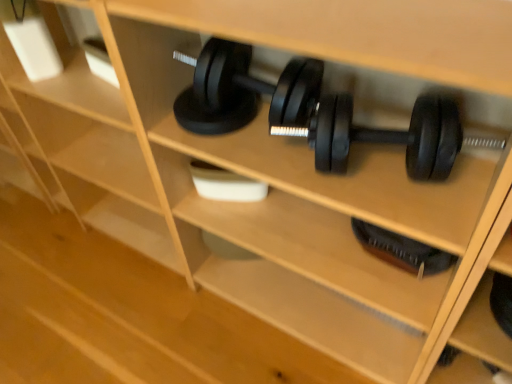
This screenshot has height=384, width=512. Find the location of `black rubber dumbbell at center, the first dumbbell when ordered from front to back`. black rubber dumbbell at center, the first dumbbell when ordered from front to back is located at coordinates (386, 135).

This screenshot has height=384, width=512. What do you see at coordinates (386, 135) in the screenshot? I see `black rubber dumbbell at center, placed as the second dumbbell when sorted from bottom to top` at bounding box center [386, 135].

What do you see at coordinates (401, 250) in the screenshot? I see `black rubber dumbbell at lower center, which ranks as the 2th dumbbell in front-to-back order` at bounding box center [401, 250].

Where is `black rubber dumbbell at lower center, which ranks as the 2th dumbbell in front-to-back order`? black rubber dumbbell at lower center, which ranks as the 2th dumbbell in front-to-back order is located at coordinates (401, 250).

Measure the distance between point [418,269] and camera.

Point [418,269] and camera are 1.02 meters apart from each other.

What is the approximate width of black rubber dumbbell at lower center, placed as the first dumbbell when sorted from bottom to top?

black rubber dumbbell at lower center, placed as the first dumbbell when sorted from bottom to top, is 5.11 inches in width.

The image size is (512, 384). What are the coordinates of `black rubber dumbbell at center, which is the first dumbbell in top-to-bottom order` in the screenshot? It's located at (386, 135).

Considering the relative positions of black rubber dumbbell at center, which is the first dumbbell in top-to-bottom order, and black rubber dumbbell at lower center, the 1th dumbbell in the back-to-front sequence, in the image provided, is black rubber dumbbell at center, which is the first dumbbell in top-to-bottom order, to the left or to the right of black rubber dumbbell at lower center, the 1th dumbbell in the back-to-front sequence,?

Clearly, black rubber dumbbell at center, which is the first dumbbell in top-to-bottom order, is on the left of black rubber dumbbell at lower center, the 1th dumbbell in the back-to-front sequence, in the image.

Is black rubber dumbbell at center, placed as the second dumbbell when sorted from bottom to top, positioned in front of black rubber dumbbell at lower center, the 1th dumbbell in the back-to-front sequence?

Yes, the depth of black rubber dumbbell at center, placed as the second dumbbell when sorted from bottom to top, is less than that of black rubber dumbbell at lower center, the 1th dumbbell in the back-to-front sequence.

Considering the points (424, 132) and (355, 225), which point is in front, point (424, 132) or point (355, 225)?

Point (424, 132)

From the image's perspective, would you say black rubber dumbbell at center, which appears as the second dumbbell when viewed from the back, is shown under black rubber dumbbell at lower center, the 1th dumbbell in the back-to-front sequence?

No, from the image's perspective, black rubber dumbbell at center, which appears as the second dumbbell when viewed from the back, is not beneath black rubber dumbbell at lower center, the 1th dumbbell in the back-to-front sequence.

From a real-world perspective, is black rubber dumbbell at center, the first dumbbell when ordered from front to back, above or below black rubber dumbbell at lower center, which is the second dumbbell from top to bottom?

Clearly, from a real-world perspective, black rubber dumbbell at center, the first dumbbell when ordered from front to back, is above black rubber dumbbell at lower center, which is the second dumbbell from top to bottom.

In terms of width, does black rubber dumbbell at center, which appears as the second dumbbell when viewed from the back, look wider or thinner when compared to black rubber dumbbell at lower center, placed as the first dumbbell when sorted from bottom to top?

Clearly, black rubber dumbbell at center, which appears as the second dumbbell when viewed from the back, has more width compared to black rubber dumbbell at lower center, placed as the first dumbbell when sorted from bottom to top.

Between black rubber dumbbell at center, which is the first dumbbell in top-to-bottom order, and black rubber dumbbell at lower center, the 1th dumbbell in the back-to-front sequence, which one has less height?

Standing shorter between the two is black rubber dumbbell at lower center, the 1th dumbbell in the back-to-front sequence.

Is black rubber dumbbell at center, which is the first dumbbell in top-to-bottom order, bigger than black rubber dumbbell at lower center, which ranks as the 2th dumbbell in front-to-back order?

Correct, black rubber dumbbell at center, which is the first dumbbell in top-to-bottom order, is larger in size than black rubber dumbbell at lower center, which ranks as the 2th dumbbell in front-to-back order.

Which is correct: black rubber dumbbell at center, the first dumbbell when ordered from front to back, is inside black rubber dumbbell at lower center, which ranks as the 2th dumbbell in front-to-back order, or outside of it?

black rubber dumbbell at center, the first dumbbell when ordered from front to back, is not enclosed by black rubber dumbbell at lower center, which ranks as the 2th dumbbell in front-to-back order.

Are black rubber dumbbell at center, placed as the second dumbbell when sorted from bottom to top, and black rubber dumbbell at lower center, which ranks as the 2th dumbbell in front-to-back order, beside each other?

No, black rubber dumbbell at center, placed as the second dumbbell when sorted from bottom to top, is not in contact with black rubber dumbbell at lower center, which ranks as the 2th dumbbell in front-to-back order.

Is black rubber dumbbell at center, which appears as the second dumbbell when viewed from the back, facing towards black rubber dumbbell at lower center, which ranks as the 2th dumbbell in front-to-back order?

No, black rubber dumbbell at center, which appears as the second dumbbell when viewed from the back, is not oriented towards black rubber dumbbell at lower center, which ranks as the 2th dumbbell in front-to-back order.

How different are the orientations of black rubber dumbbell at center, which is the first dumbbell in top-to-bottom order, and black rubber dumbbell at lower center, placed as the first dumbbell when sorted from bottom to top, in degrees?

black rubber dumbbell at center, which is the first dumbbell in top-to-bottom order, and black rubber dumbbell at lower center, placed as the first dumbbell when sorted from bottom to top, are facing 26.3 degrees away from each other.

Find the location of a particular element. This screenshot has width=512, height=384. dumbbell behind the black rubber dumbbell at center, which is the first dumbbell in top-to-bottom order is located at coordinates coord(401,250).

Is black rubber dumbbell at lower center, the 1th dumbbell in the back-to-front sequence, to the right of black rubber dumbbell at center, the first dumbbell when ordered from front to back, from the viewer's perspective?

Indeed, black rubber dumbbell at lower center, the 1th dumbbell in the back-to-front sequence, is positioned on the right side of black rubber dumbbell at center, the first dumbbell when ordered from front to back.

Relative to black rubber dumbbell at center, which is the first dumbbell in top-to-bottom order, is black rubber dumbbell at lower center, which ranks as the 2th dumbbell in front-to-back order, in front or behind?

Result: black rubber dumbbell at lower center, which ranks as the 2th dumbbell in front-to-back order, is behind black rubber dumbbell at center, which is the first dumbbell in top-to-bottom order.

Considering the points (452, 257) and (415, 170), which point is in front, point (452, 257) or point (415, 170)?

The point (415, 170) is closer to the camera.

From the image's perspective, is black rubber dumbbell at lower center, placed as the first dumbbell when sorted from bottom to top, positioned above or below black rubber dumbbell at center, which is the first dumbbell in top-to-bottom order?

From the image's perspective, black rubber dumbbell at lower center, placed as the first dumbbell when sorted from bottom to top, appears below black rubber dumbbell at center, which is the first dumbbell in top-to-bottom order.

From a real-world perspective, does black rubber dumbbell at lower center, placed as the first dumbbell when sorted from bottom to top, sit lower than black rubber dumbbell at center, placed as the second dumbbell when sorted from bottom to top?

Indeed, from a real-world perspective, black rubber dumbbell at lower center, placed as the first dumbbell when sorted from bottom to top, is positioned beneath black rubber dumbbell at center, placed as the second dumbbell when sorted from bottom to top.

Between black rubber dumbbell at lower center, which is the second dumbbell from top to bottom, and black rubber dumbbell at center, the first dumbbell when ordered from front to back, which one has larger width?

Wider between the two is black rubber dumbbell at center, the first dumbbell when ordered from front to back.

Is black rubber dumbbell at lower center, which ranks as the 2th dumbbell in front-to-back order, shorter than black rubber dumbbell at center, the first dumbbell when ordered from front to back?

Yes, black rubber dumbbell at lower center, which ranks as the 2th dumbbell in front-to-back order, is shorter than black rubber dumbbell at center, the first dumbbell when ordered from front to back.

Which of these two, black rubber dumbbell at lower center, which ranks as the 2th dumbbell in front-to-back order, or black rubber dumbbell at center, the first dumbbell when ordered from front to back, is bigger?

black rubber dumbbell at center, the first dumbbell when ordered from front to back, is bigger.

Choose the correct answer: Is black rubber dumbbell at lower center, which ranks as the 2th dumbbell in front-to-back order, inside black rubber dumbbell at center, which is the first dumbbell in top-to-bottom order, or outside it?

black rubber dumbbell at lower center, which ranks as the 2th dumbbell in front-to-back order, cannot be found inside black rubber dumbbell at center, which is the first dumbbell in top-to-bottom order.

Is black rubber dumbbell at lower center, placed as the first dumbbell when sorted from bottom to top, touching black rubber dumbbell at center, which is the first dumbbell in top-to-bottom order?

black rubber dumbbell at lower center, placed as the first dumbbell when sorted from bottom to top, is not next to black rubber dumbbell at center, which is the first dumbbell in top-to-bottom order, and they're not touching.

Looking at this image, could you tell me if black rubber dumbbell at lower center, which ranks as the 2th dumbbell in front-to-back order, is turned towards black rubber dumbbell at center, placed as the second dumbbell when sorted from bottom to top?

No.

Can you tell me how much black rubber dumbbell at lower center, which ranks as the 2th dumbbell in front-to-back order, and black rubber dumbbell at center, which appears as the second dumbbell when viewed from the back, differ in facing direction?

26.3 degrees separate the facing orientations of black rubber dumbbell at lower center, which ranks as the 2th dumbbell in front-to-back order, and black rubber dumbbell at center, which appears as the second dumbbell when viewed from the back.

Could you measure the distance between black rubber dumbbell at lower center, the 1th dumbbell in the back-to-front sequence, and black rubber dumbbell at center, the first dumbbell when ordered from front to back?

black rubber dumbbell at lower center, the 1th dumbbell in the back-to-front sequence, is 12.87 inches away from black rubber dumbbell at center, the first dumbbell when ordered from front to back.

Image resolution: width=512 pixels, height=384 pixels. I want to click on dumbbell above the black rubber dumbbell at lower center, the 1th dumbbell in the back-to-front sequence (from a real-world perspective), so click(x=386, y=135).

Image resolution: width=512 pixels, height=384 pixels. What are the coordinates of `dumbbell located underneath the black rubber dumbbell at center, the first dumbbell when ordered from front to back (from a real-world perspective)` in the screenshot? It's located at (401, 250).

The width and height of the screenshot is (512, 384). I want to click on dumbbell above the black rubber dumbbell at lower center, placed as the first dumbbell when sorted from bottom to top (from the image's perspective), so click(x=386, y=135).